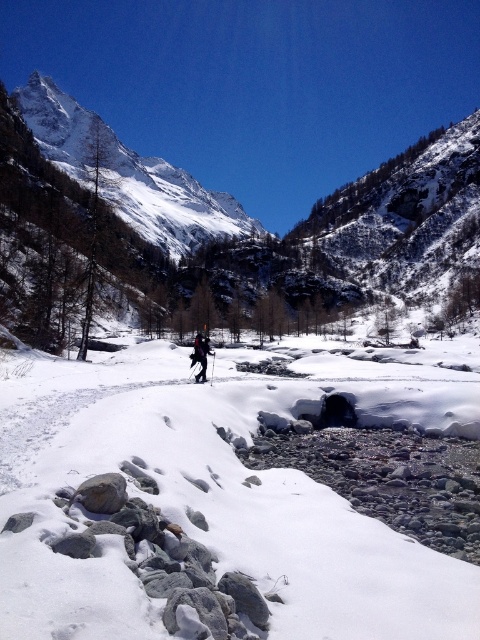
You are a hiker planning to take a photo of the snowy granite mountain at upper center and dark blue jacket at center. Which object should you focus on first if you want to capture both in a single frame without moving the camera?

You should focus on the snowy granite mountain at upper center first because it is larger than the dark blue jacket at center, allowing you to ensure it fits within the frame before adjusting for the smaller object.

You are a hiker planning to cross the white powder snow at center. Based on the coordinates provided, can you determine if the snow is located in the upper or lower half of the image?

The white powder snow at center is located at coordinates point (x=225, y=497). Since the y coordinate is 0.469, which is less than 0.5, it is in the lower half of the image.